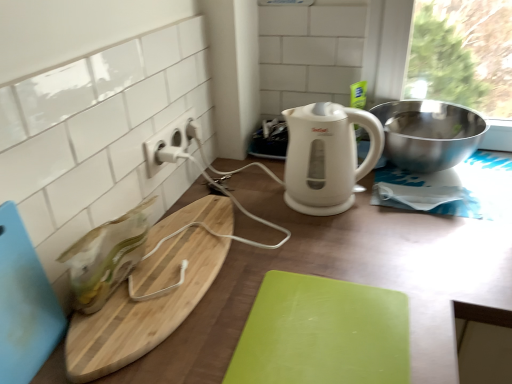
Identify the location of empty space that is ontop of green matte cutting board at center, arranged as the 3th cutting board when viewed from the left (from a real-world perspective). (319, 331).